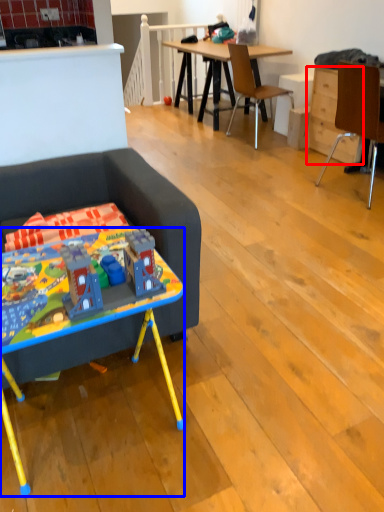
Question: Which of the following is the closest to the observer, drawer (highlighted by a red box) or desk (highlighted by a blue box)?

Choices:
 (A) drawer
 (B) desk

Answer: (B)